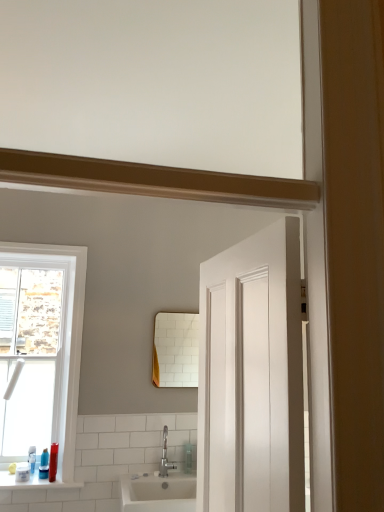
Question: Does white glossy window sill at lower left lie in front of clear plastic soap dispenser at center?

Choices:
 (A) yes
 (B) no

Answer: (A)

Question: Is white glossy window sill at lower left further to the viewer compared to clear plastic soap dispenser at center?

Choices:
 (A) yes
 (B) no

Answer: (B)

Question: Considering the relative sizes of white glossy window sill at lower left and clear plastic soap dispenser at center in the image provided, is white glossy window sill at lower left shorter than clear plastic soap dispenser at center?

Choices:
 (A) no
 (B) yes

Answer: (B)

Question: Would you say clear plastic soap dispenser at center is part of white glossy window sill at lower left's contents?

Choices:
 (A) no
 (B) yes

Answer: (A)

Question: Are white glossy window sill at lower left and clear plastic soap dispenser at center far apart?

Choices:
 (A) no
 (B) yes

Answer: (A)

Question: In terms of size, does white glossy window at left appear bigger or smaller than silver metallic faucet at lower center?

Choices:
 (A) big
 (B) small

Answer: (A)

Question: Considering their positions, is white glossy window at left located in front of or behind silver metallic faucet at lower center?

Choices:
 (A) front
 (B) behind

Answer: (A)

Question: From the image's perspective, is white glossy window at left positioned above or below silver metallic faucet at lower center?

Choices:
 (A) below
 (B) above

Answer: (B)

Question: Choose the correct answer: Is white glossy window at left inside silver metallic faucet at lower center or outside it?

Choices:
 (A) outside
 (B) inside

Answer: (A)

Question: Would you say translucent plastic soap at lower left, which appears as the first toiletry when viewed from the left, is to the left or to the right of silver metallic faucet at lower center in the picture?

Choices:
 (A) right
 (B) left

Answer: (B)

Question: Considering the positions of translucent plastic soap at lower left, which ranks as the second toiletry in right-to-left order, and silver metallic faucet at lower center in the image, is translucent plastic soap at lower left, which ranks as the second toiletry in right-to-left order, bigger or smaller than silver metallic faucet at lower center?

Choices:
 (A) small
 (B) big

Answer: (A)

Question: Is translucent plastic soap at lower left, which appears as the first toiletry when viewed from the left, in front of or behind silver metallic faucet at lower center in the image?

Choices:
 (A) behind
 (B) front

Answer: (B)

Question: From their relative heights in the image, would you say translucent plastic soap at lower left, which ranks as the second toiletry in right-to-left order, is taller or shorter than silver metallic faucet at lower center?

Choices:
 (A) tall
 (B) short

Answer: (B)

Question: From the image's perspective, is translucent plastic bottle at lower left, the 2th toiletry positioned from the left, positioned above or below white glossy window at left?

Choices:
 (A) above
 (B) below

Answer: (B)

Question: Is point [49, 462] closer or farther from the camera than point [69, 290]?

Choices:
 (A) closer
 (B) farther

Answer: (A)